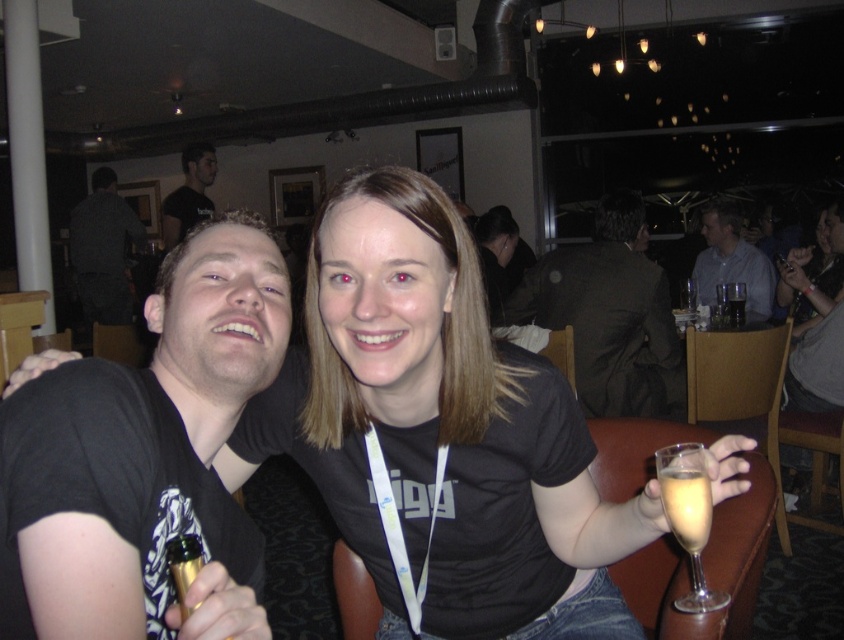
Does point (258, 244) lie in front of point (203, 561)?

No, (258, 244) is behind (203, 561).

This screenshot has width=844, height=640. I want to click on black matte t-shirt at left, so click(219, 324).

Can you confirm if black matte shirt at center is positioned to the left of dark brown leather jacket at upper right?

Correct, you'll find black matte shirt at center to the left of dark brown leather jacket at upper right.

Describe the element at coordinates (441, 429) in the screenshot. I see `black matte shirt at center` at that location.

Identify the location of black matte shirt at center. This screenshot has width=844, height=640. (441, 429).

Who is lower down, black fabric shirt at upper center or light blue shirt at upper right?

Positioned lower is black fabric shirt at upper center.

Between point (842, 356) and point (699, 266), which one is positioned in front?

Point (842, 356) is in front.

You are a GUI agent. You are given a task and a screenshot of the screen. Output one action in this format:
    pyautogui.click(x=<x>, y=<y>)
    Task: Click on the black fabric shirt at upper center
    This screenshot has height=640, width=844.
    Given the screenshot: What is the action you would take?
    pyautogui.click(x=814, y=349)